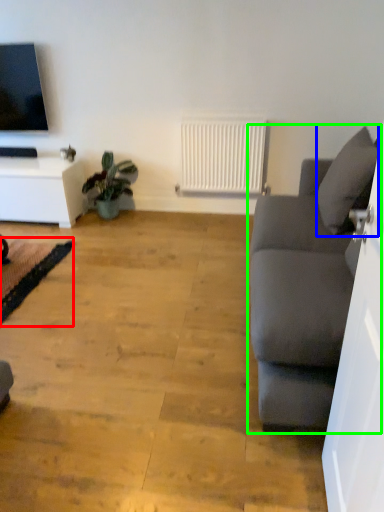
Question: Based on their relative distances, which object is nearer to yoga mat (highlighted by a red box)? Choose from pillow (highlighted by a blue box) and studio couch (highlighted by a green box).

Choices:
 (A) pillow
 (B) studio couch

Answer: (B)